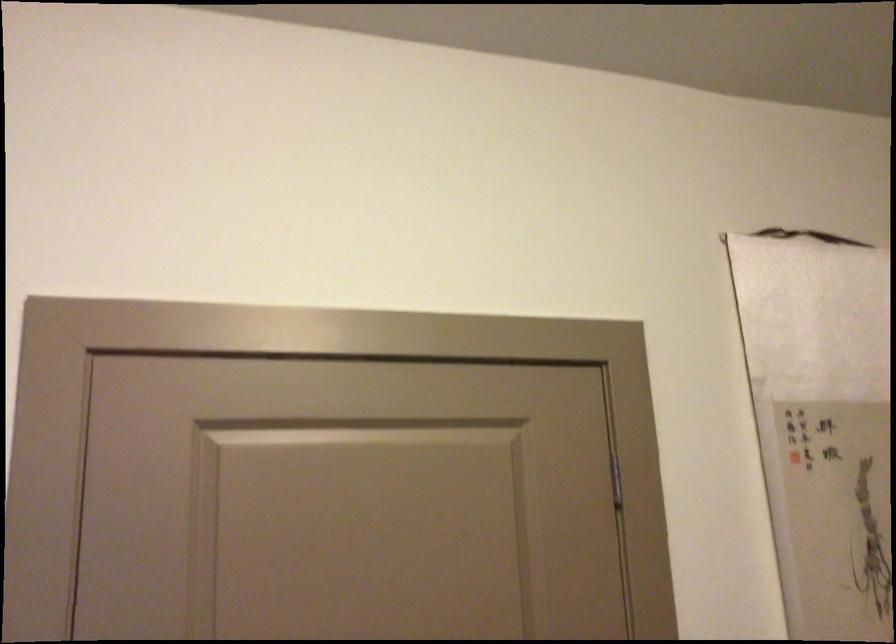
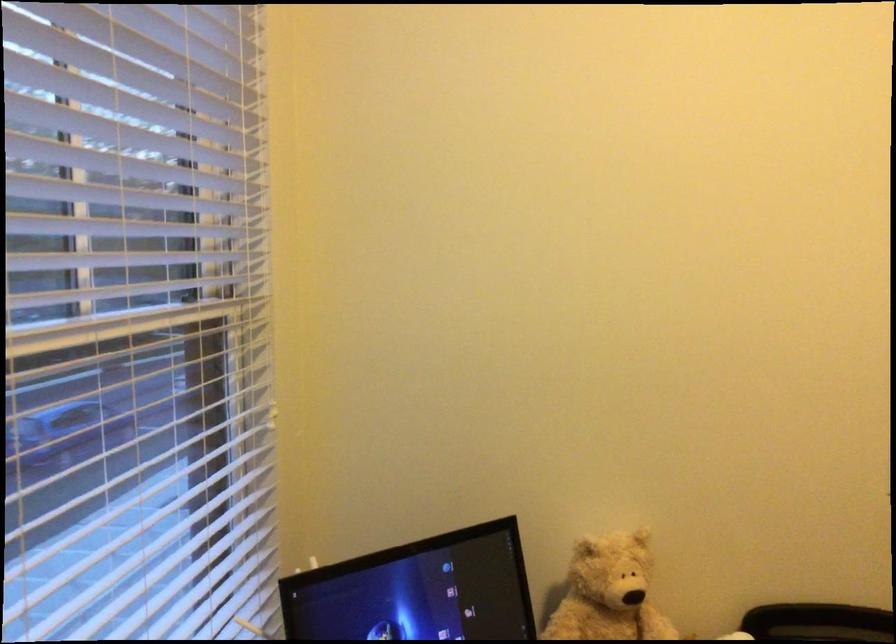
Question: The images are taken continuously from a first-person perspective. In which direction is your viewpoint rotating?

Choices:
 (A) Left
 (B) Right
 (C) Up
 (D) Down

Answer: (A)